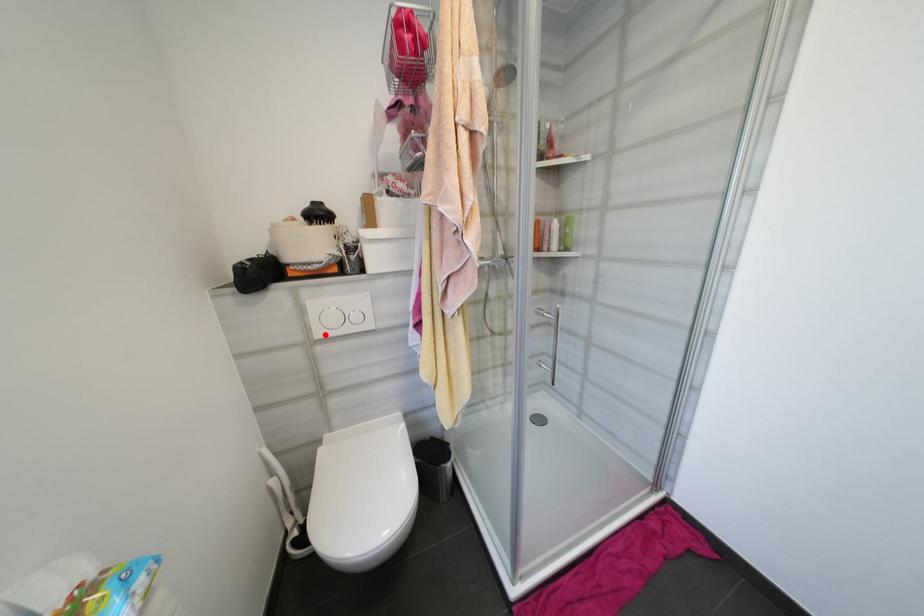
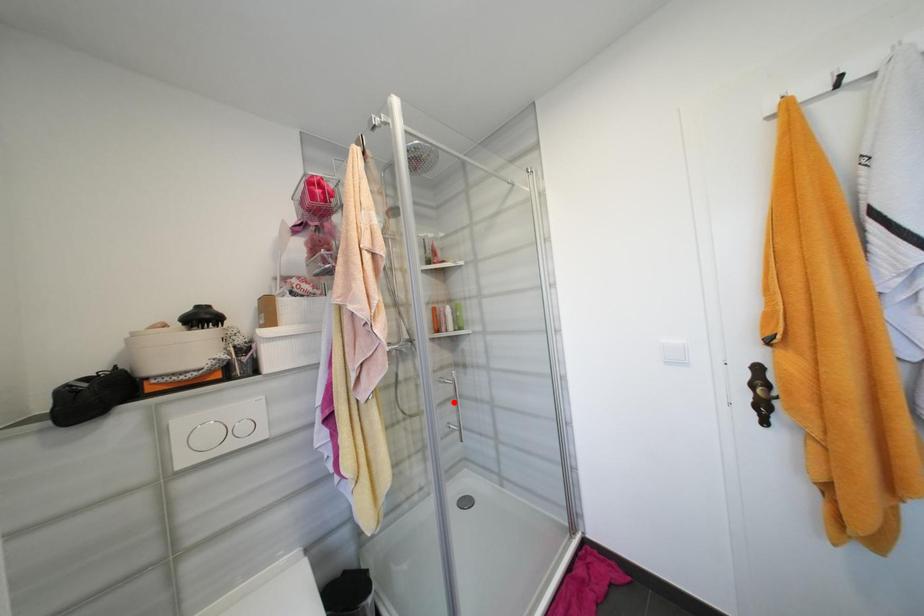
I am providing you with two images of the same scene from different viewpoints. A red point is marked on the first image and another point is marked on the second image. Do the highlighted points in image1 and image2 indicate the same real-world spot?

No